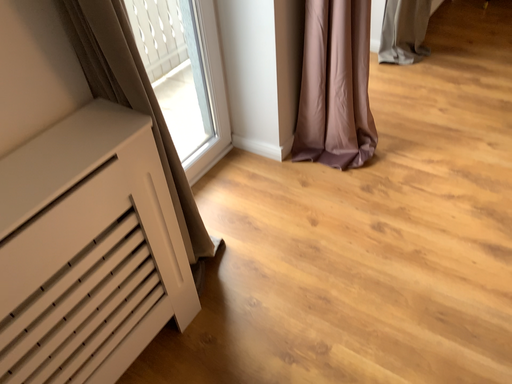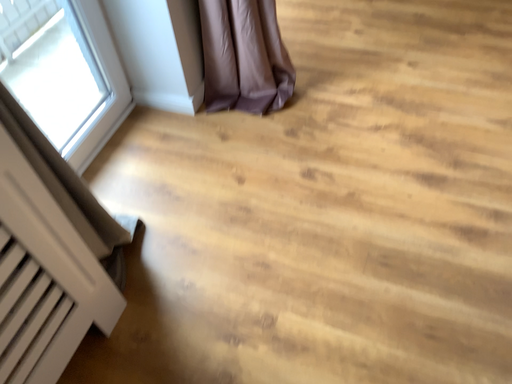
Question: Which way did the camera rotate in the video?

Choices:
 (A) rotated left
 (B) rotated right

Answer: (B)